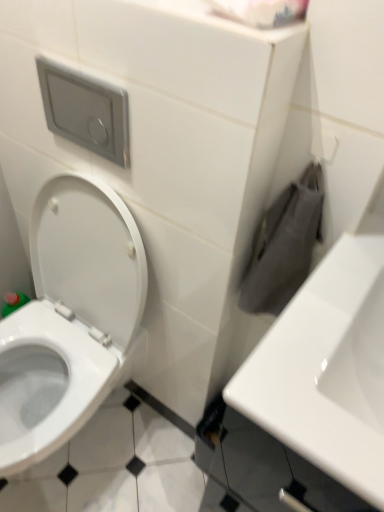
Question: Is white glossy toilet at left taller or shorter than white matte toilet paper at upper center?

Choices:
 (A) short
 (B) tall

Answer: (B)

Question: Relative to white matte toilet paper at upper center, is white glossy toilet at left in front or behind?

Choices:
 (A) behind
 (B) front

Answer: (A)

Question: Which object is positioned closest to the white glossy toilet at left?

Choices:
 (A) white glossy sink at right
 (B) white matte toilet paper at upper center

Answer: (A)

Question: Which of these objects is positioned closest to the white matte toilet paper at upper center?

Choices:
 (A) white glossy toilet at left
 (B) white glossy sink at right

Answer: (B)